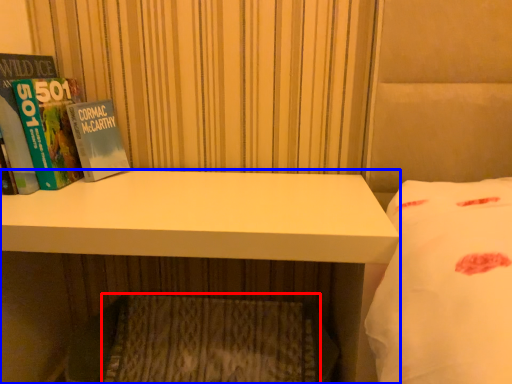
Question: Which point is further to the camera, mattress (highlighted by a red box) or desk (highlighted by a blue box)?

Choices:
 (A) mattress
 (B) desk

Answer: (A)